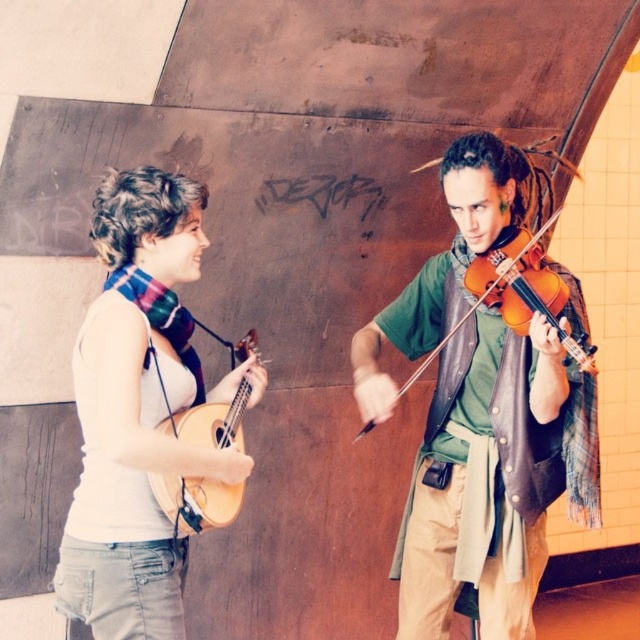
You are a photographer positioned in front of the two musicians. You want to take a photo where both the white matte guitar at left and the orange matte violin at right are clearly visible. Which instrument should you focus on first to ensure both are in focus?

The white matte guitar at left is closer to the viewer than the orange matte violin at right. To ensure both are in focus, you should focus on the white matte guitar at left first, as it is the closer object, and adjust the depth of field to include the orange matte violin at right.

You are a photographer setting up for a photo shoot. You have a matte green shirt at center and a white matte guitar at left in your frame. Which object is wider in the scene?

The matte green shirt at center is wider than the white matte guitar at left.